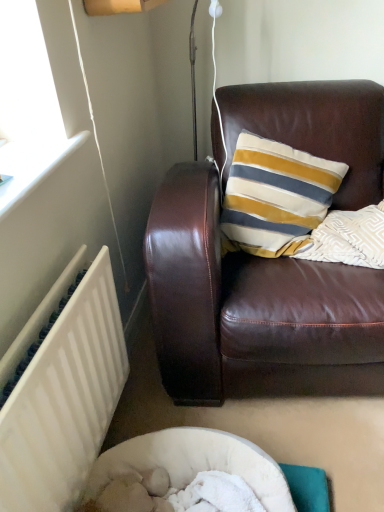
Question: Do you think white painted radiator at lower left is within brown leather couch at upper right, or outside of it?

Choices:
 (A) inside
 (B) outside

Answer: (B)

Question: From the image's perspective, is white painted radiator at lower left positioned above or below brown leather couch at upper right?

Choices:
 (A) above
 (B) below

Answer: (B)

Question: Does point (0, 479) appear closer or farther from the camera than point (317, 355)?

Choices:
 (A) closer
 (B) farther

Answer: (A)

Question: From the image's perspective, is brown leather couch at upper right positioned above or below white painted radiator at lower left?

Choices:
 (A) below
 (B) above

Answer: (B)

Question: Is point (294, 96) positioned closer to the camera than point (67, 306)?

Choices:
 (A) closer
 (B) farther

Answer: (B)

Question: Considering the positions of brown leather couch at upper right and white painted radiator at lower left in the image, is brown leather couch at upper right taller or shorter than white painted radiator at lower left?

Choices:
 (A) short
 (B) tall

Answer: (B)

Question: In the image, is brown leather couch at upper right positioned in front of or behind white painted radiator at lower left?

Choices:
 (A) front
 (B) behind

Answer: (B)